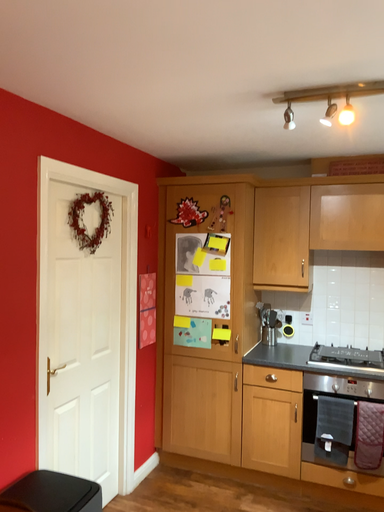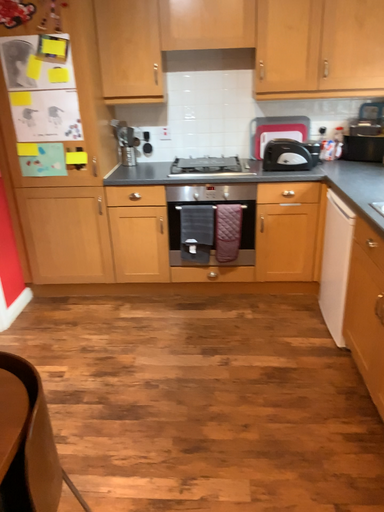
Question: How did the camera likely rotate when shooting the video?

Choices:
 (A) rotated right
 (B) rotated left

Answer: (A)